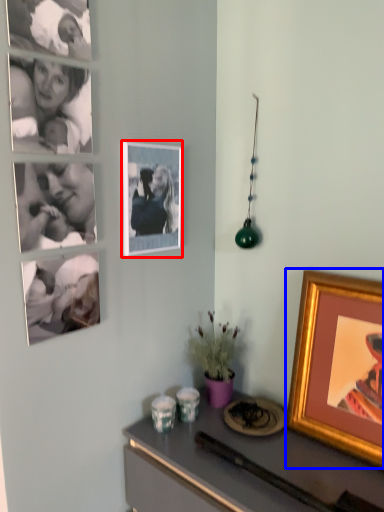
Question: Which of the following is the closest to the observer, picture frame (highlighted by a red box) or picture frame (highlighted by a blue box)?

Choices:
 (A) picture frame
 (B) picture frame

Answer: (B)